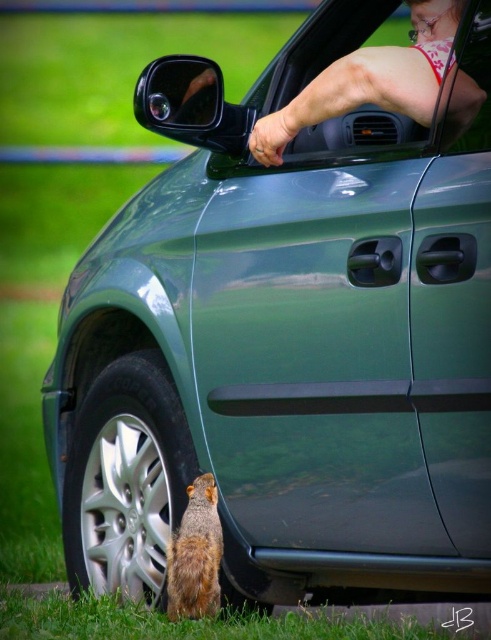
You are a photographer trying to capture the scene of the green car parked on grass with the squirrel. You need to focus your camera on the matte pink skin at upper right. What coordinates should you aim for?

The coordinates for the matte pink skin at upper right are at point (383, 84).

You are a photographer trying to capture a closeup of the brown fur squirrel at lower left without including the matte pink skin at upper right in the frame. Based on their sizes, which one should you zoom in on more to ensure the squirrel is the main focus?

The matte pink skin at upper right is larger than the brown fur squirrel at lower left. To focus on the squirrel, you should zoom in on the brown fur squirrel at lower left since it is smaller and requires closer attention to fill the frame without including the larger matte pink skin at upper right.